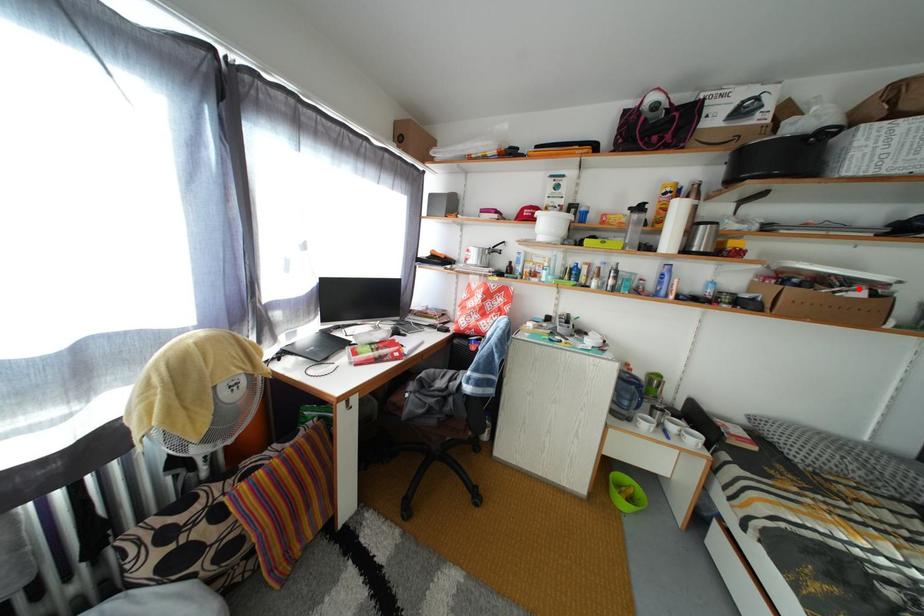
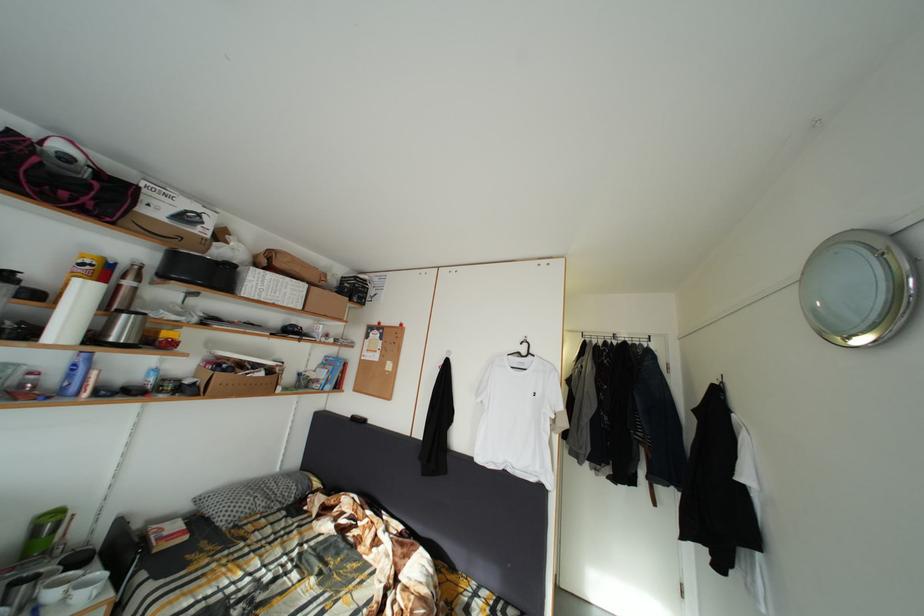
Find the pixel in the second image that matches the highlighted location in the first image.

(264, 373)